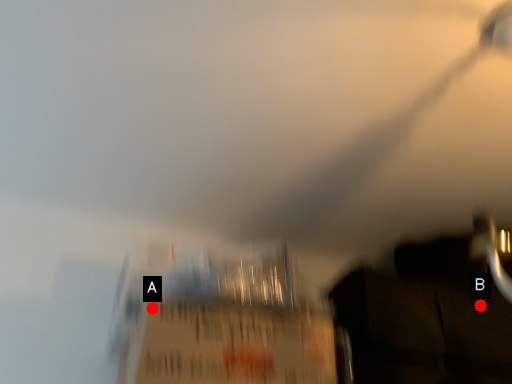
Question: Two points are circled on the image, labeled by A and B beside each circle. Which point is closer to the camera taking this photo?

Choices:
 (A) A is closer
 (B) B is closer

Answer: (A)